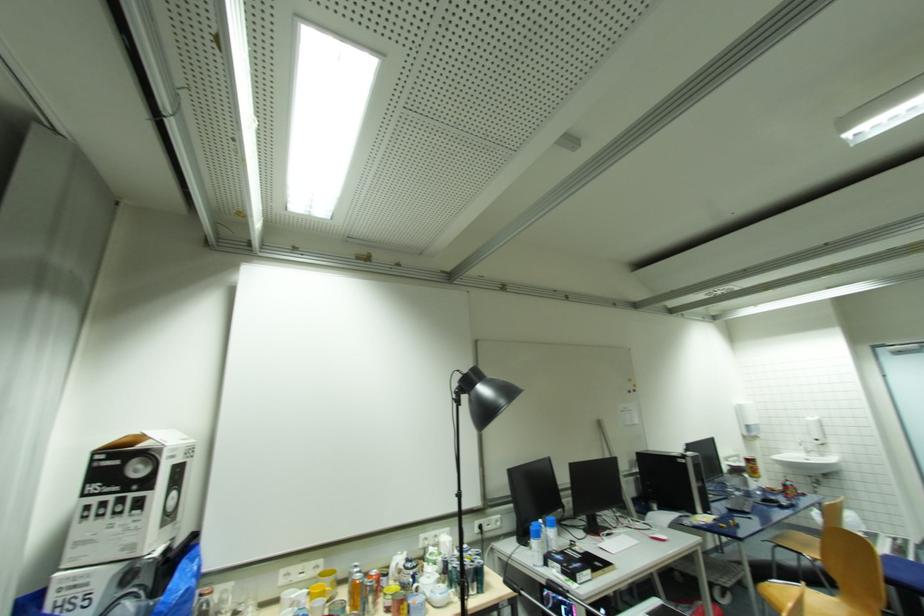
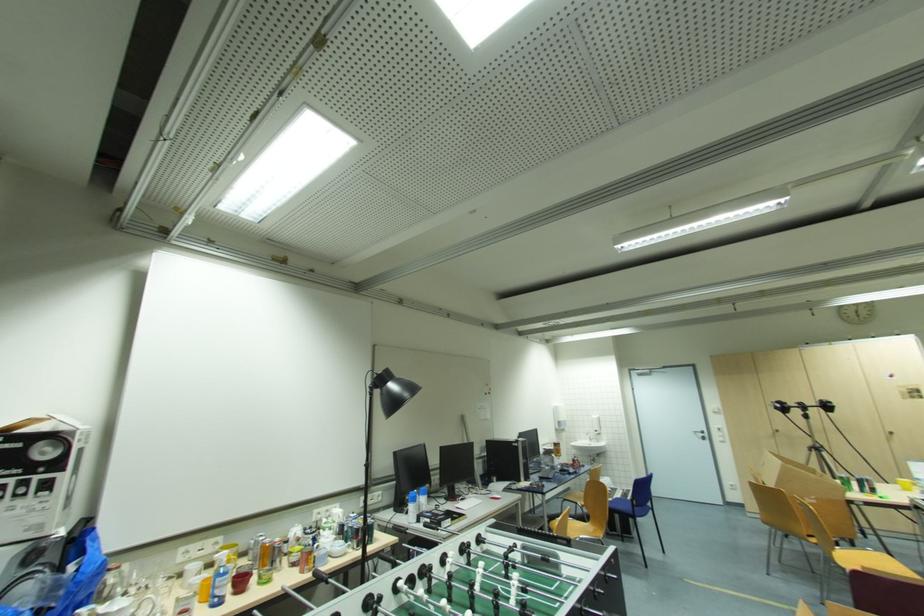
Question: I am providing you with two images of the same scene from different viewpoints. After the viewpoint changes to image2, which objects are now occluded?

Choices:
 (A) foosball table handle
 (B) blue chair sitting surface
 (C) soap dispenser pump
 (D) none of these

Answer: (D)